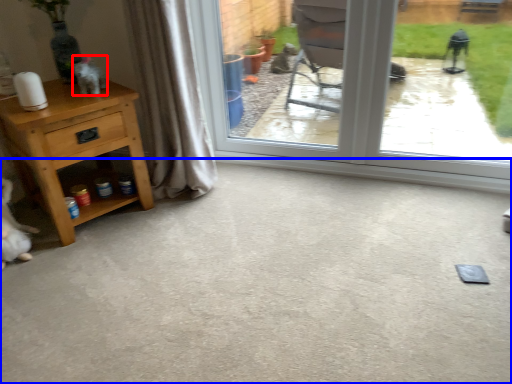
Question: Which object is closer to the camera taking this photo, animal (highlighted by a red box) or concrete (highlighted by a blue box)?

Choices:
 (A) animal
 (B) concrete

Answer: (B)